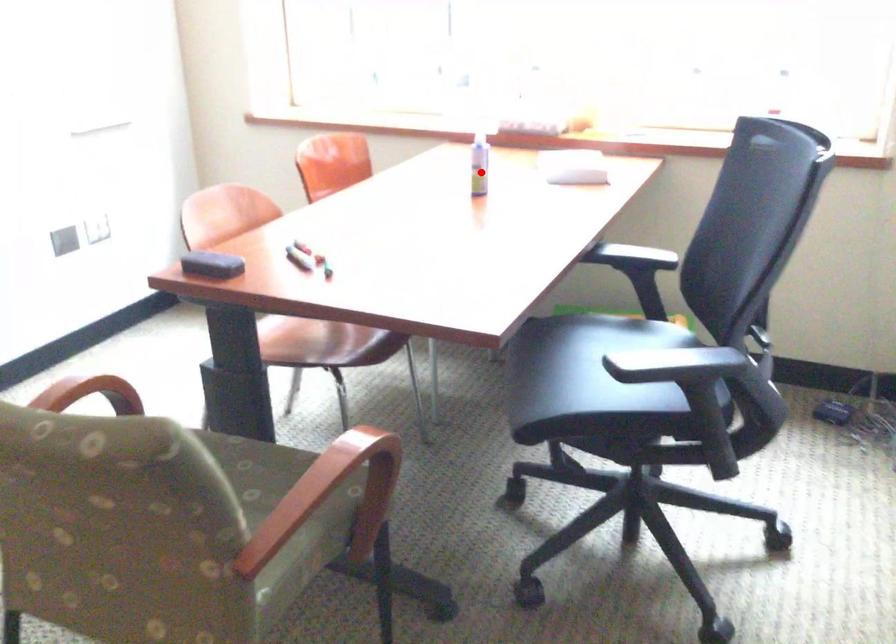
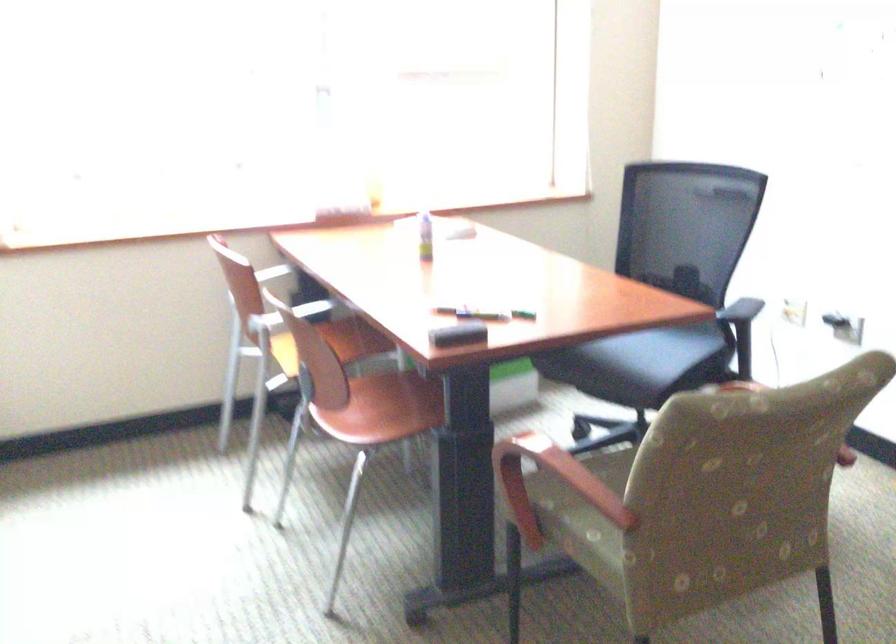
Question: I am providing you with two images of the same scene from different viewpoints. Given a red point in image1, look at the same physical point in image2. Is it:

Choices:
 (A) Closer to the viewpoint
 (B) Farther from the viewpoint

Answer: (B)